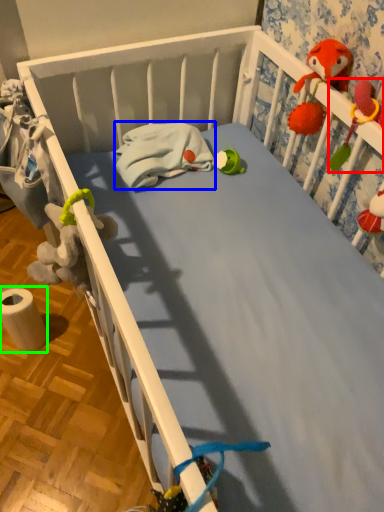
Question: Which object is the closest to the toy (highlighted by a red box)? Choose among these: material (highlighted by a blue box) or toilet paper (highlighted by a green box).

Choices:
 (A) material
 (B) toilet paper

Answer: (A)